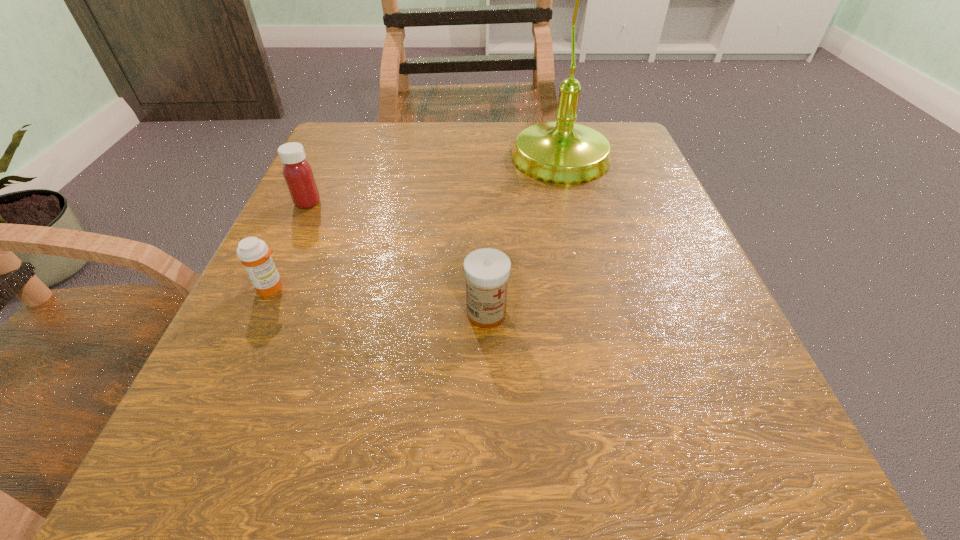
Where is `lamp`? Image resolution: width=960 pixels, height=540 pixels. lamp is located at coordinates (561, 152).

I want to click on the farthest medicine, so click(x=298, y=174).

The image size is (960, 540). Find the location of `the nearest object`. the nearest object is located at coordinates (487, 271).

At what (x,y) coordinates should I click in order to perform the action: click on the nearest medicine. Please return your answer as a coordinate pair (x, y). The image size is (960, 540). Looking at the image, I should click on 487,271.

The image size is (960, 540). I want to click on the second farthest medicine, so click(x=253, y=253).

The height and width of the screenshot is (540, 960). I want to click on free space located 0.060m on the desk next to the tallest object, so click(x=459, y=163).

At what (x,y) coordinates should I click in order to perform the action: click on vacant space located 0.250m on the desk next to the tallest object. Please return your answer as a coordinate pair (x, y). Looking at the image, I should click on (366, 163).

Where is `free point located on the desk next to the tallest object`? free point located on the desk next to the tallest object is located at coordinates (410, 163).

Where is `blank space located on the right of the farthest medicine`? The image size is (960, 540). blank space located on the right of the farthest medicine is located at coordinates [x=393, y=202].

Where is `vacant space positioned 0.160m on the front of the nearest object`? This screenshot has width=960, height=540. vacant space positioned 0.160m on the front of the nearest object is located at coordinates (489, 446).